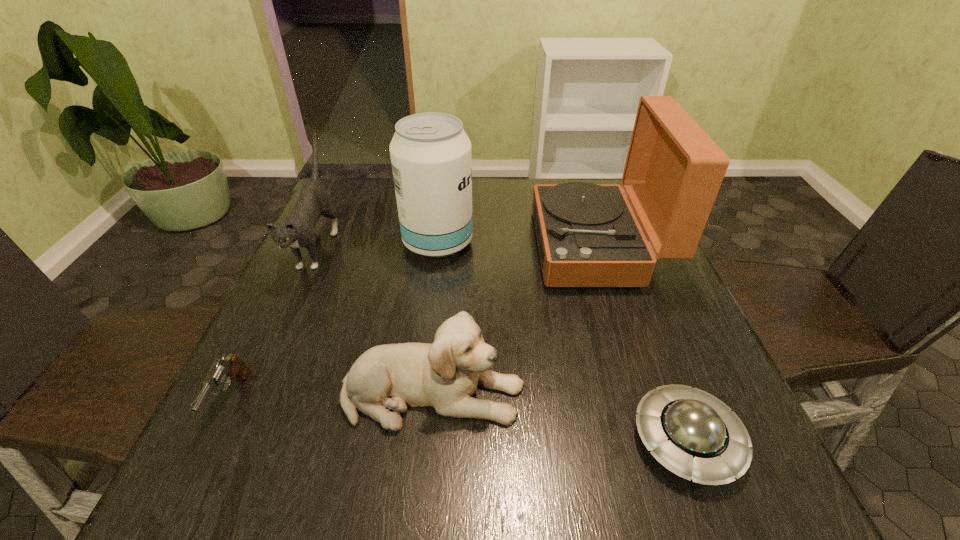
I want to click on phonograph record, so click(588, 236).

Locate an element on the screen. The width and height of the screenshot is (960, 540). alcohol is located at coordinates (431, 159).

I want to click on cat, so click(x=297, y=230).

This screenshot has width=960, height=540. Find the location of `the fourth tallest object`. the fourth tallest object is located at coordinates (444, 375).

This screenshot has width=960, height=540. In order to click on the fifth tallest object in this screenshot , I will do (229, 368).

Locate an element on the screen. The width and height of the screenshot is (960, 540). saucer is located at coordinates (693, 434).

Identify the location of free spot located 0.210m on the face of the phonograph record. Image resolution: width=960 pixels, height=540 pixels. [x=453, y=246].

Locate an element on the screen. free location located on the face of the phonograph record is located at coordinates (469, 246).

In order to click on free location located 0.370m on the face of the phonograph record in this screenshot , I will do click(x=390, y=246).

The width and height of the screenshot is (960, 540). Find the location of `blank area located on the right of the alcohol`. blank area located on the right of the alcohol is located at coordinates 563,242.